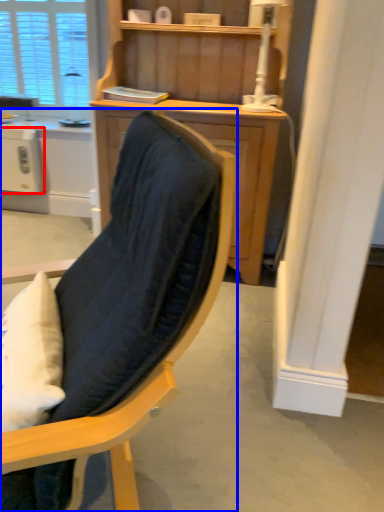
Question: Which point is further to the camera, appliance (highlighted by a red box) or chair (highlighted by a blue box)?

Choices:
 (A) appliance
 (B) chair

Answer: (A)